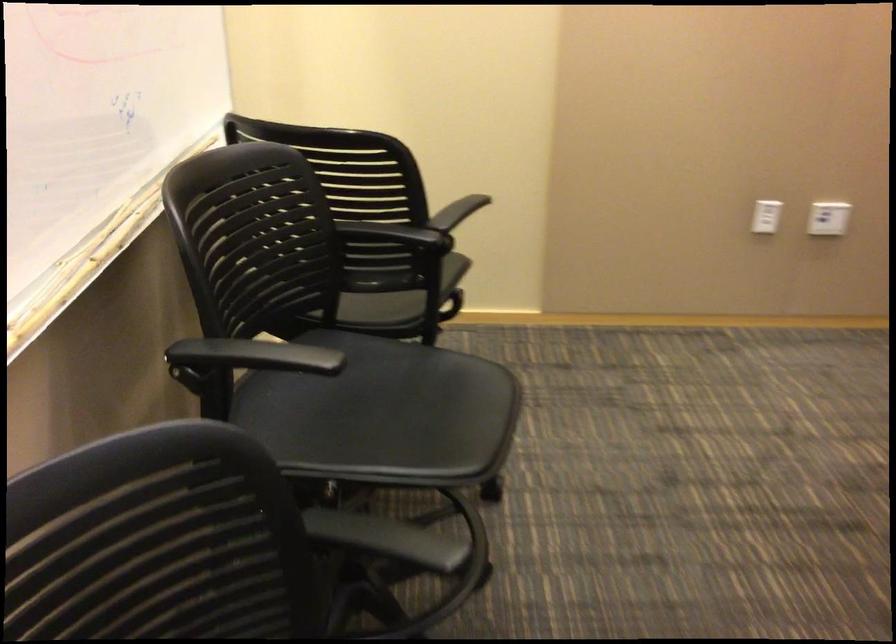
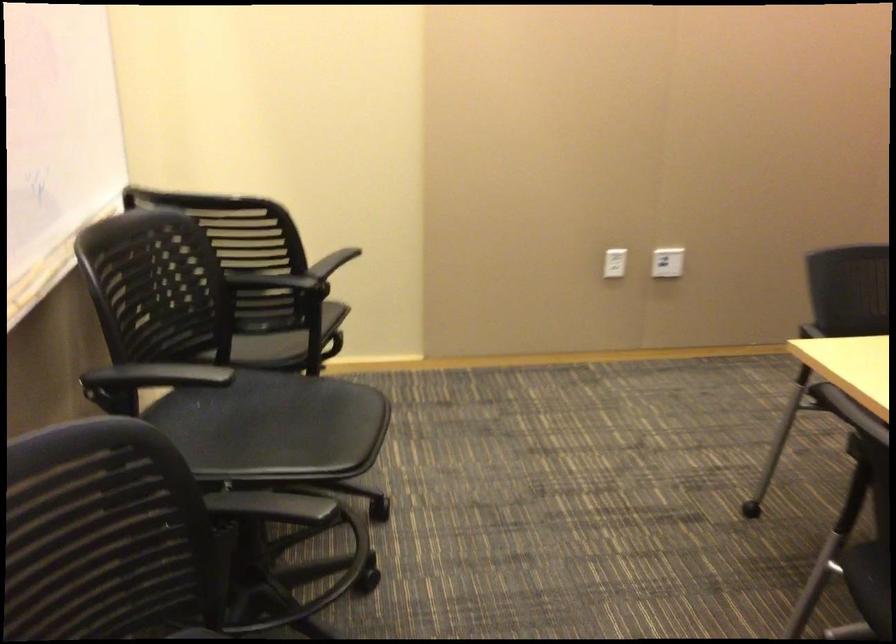
Question: The camera is either moving clockwise (left) or counter-clockwise (right) around the object. The first image is from the beginning of the video and the second image is from the end. Is the camera moving left or right when shooting the video?

Choices:
 (A) Left
 (B) Right

Answer: (A)